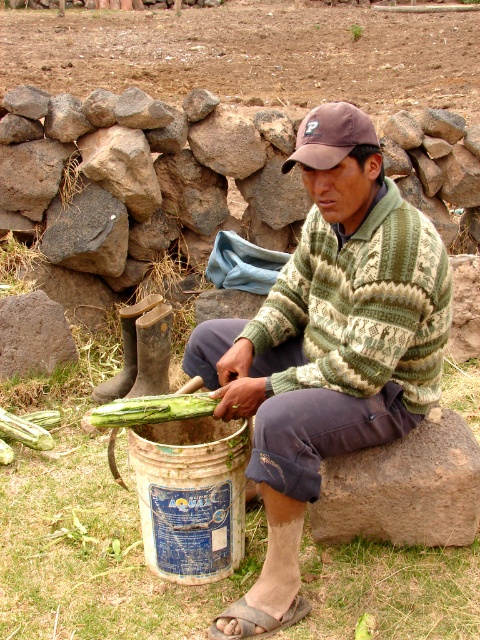
Question: Which object is closer to the camera taking this photo?

Choices:
 (A) green knitted sweater at center
 (B) brown fabric baseball cap at center

Answer: (A)

Question: Is brown rough stone at lower right closer to camera compared to green rough corn at center?

Choices:
 (A) yes
 (B) no

Answer: (B)

Question: Does green knitted sweater at center appear on the left side of green rough squash at center?

Choices:
 (A) yes
 (B) no

Answer: (B)

Question: Is green rough corn at center thinner than green rough squash at center?

Choices:
 (A) yes
 (B) no

Answer: (B)

Question: Which point is closer to the camera?

Choices:
 (A) green rough squash at center
 (B) brown rough stone at lower right

Answer: (B)

Question: Estimate the real-world distances between objects in this image. Which object is closer to the brown fabric baseball cap at center?

Choices:
 (A) green rough corn at center
 (B) green rough squash at center

Answer: (A)